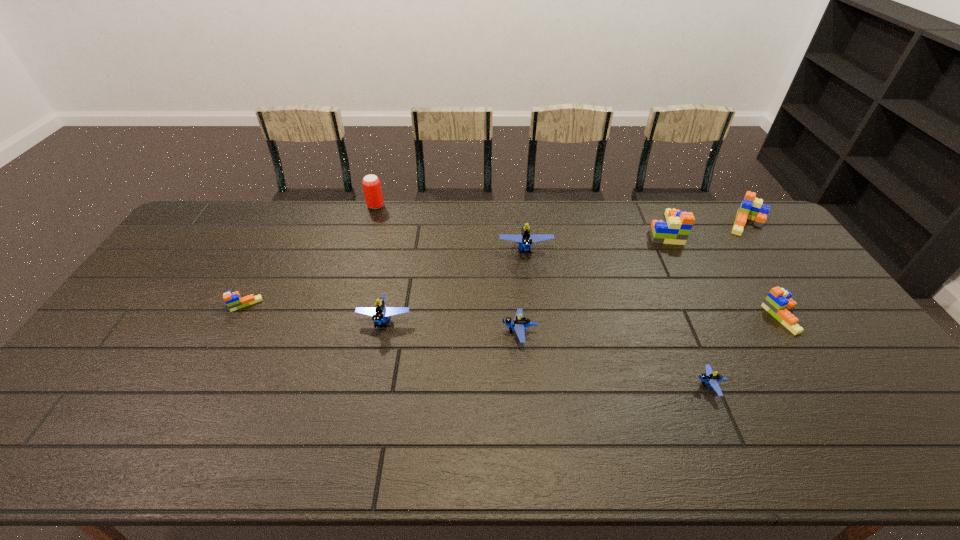
The height and width of the screenshot is (540, 960). What are the coordinates of `the leftmost Lego` in the screenshot? It's located at (233, 300).

Find the location of a particular element. The image size is (960, 540). the rightmost blue Lego is located at coordinates (710, 377).

Find the location of a particular element. the nearest object is located at coordinates point(710,377).

Image resolution: width=960 pixels, height=540 pixels. Find the location of `free location located 0.170m on the right of the beer can`. free location located 0.170m on the right of the beer can is located at coordinates (429, 206).

Identify the location of free spot located 0.240m on the right of the biggest orange Lego. (749, 228).

Identify the location of vacant space located 0.400m on the front-facing side of the biggest blue Lego. The width and height of the screenshot is (960, 540). (540, 366).

Find the location of a particular element. The width and height of the screenshot is (960, 540). vacant region located 0.110m on the left of the third smallest orange Lego is located at coordinates (695, 224).

Identify the location of vacant space situated 0.150m on the front-facing side of the third smallest blue Lego. (372, 384).

Locate an element on the screen. This screenshot has width=960, height=540. vacant space located 0.260m on the front of the second smallest orange Lego is located at coordinates (851, 422).

Image resolution: width=960 pixels, height=540 pixels. In order to click on free space located on the front-facing side of the third biggest blue Lego in this screenshot , I will do `click(473, 333)`.